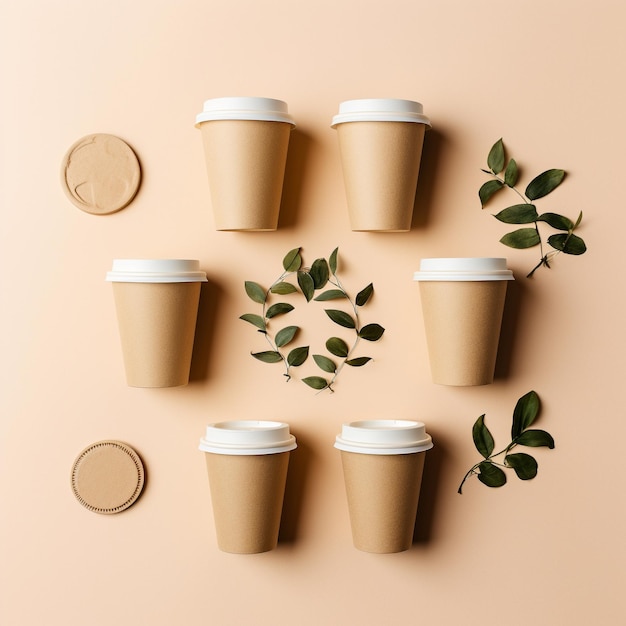
At what (x,y) coordinates should I click in order to perform the action: click on cups next to a leaf. Please return your answer as a coordinate pair (x, y). The height and width of the screenshot is (626, 626). Looking at the image, I should click on (269, 471), (387, 480), (476, 310), (379, 187), (250, 198), (170, 341).